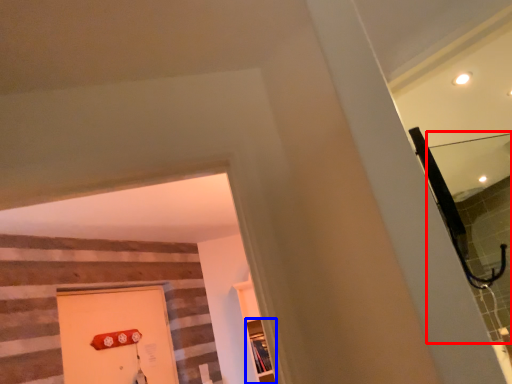
Question: Which object is closer to the camera taking this photo, mirror (highlighted by a red box) or shelf (highlighted by a blue box)?

Choices:
 (A) mirror
 (B) shelf

Answer: (A)